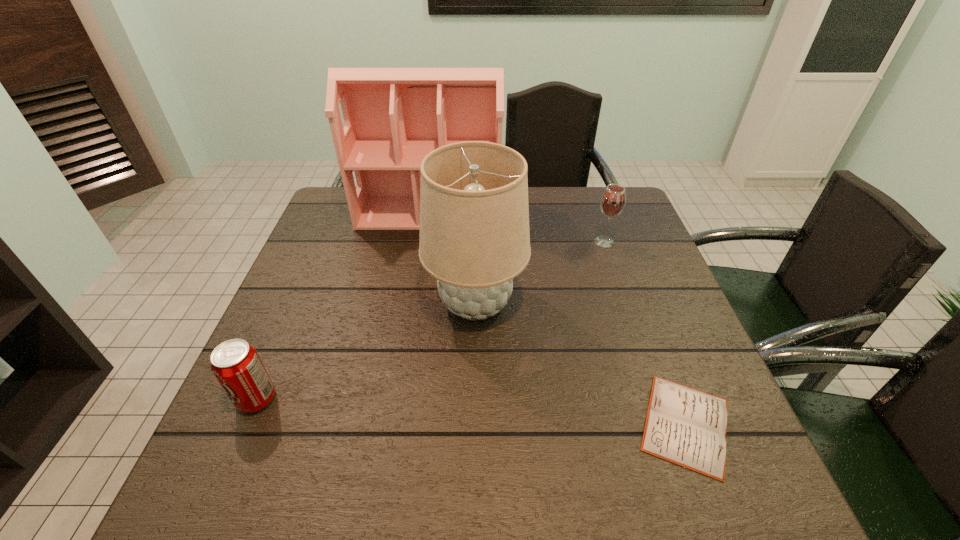
Where is `dollhouse`? This screenshot has height=540, width=960. dollhouse is located at coordinates (394, 117).

What are the coordinates of `the third nearest object` in the screenshot? It's located at pyautogui.click(x=474, y=239).

Locate an element on the screen. The image size is (960, 540). the fourth nearest object is located at coordinates (613, 200).

Find the location of a particular element. The width and height of the screenshot is (960, 540). the third tallest object is located at coordinates (613, 200).

I want to click on soda, so click(x=236, y=364).

Locate an element on the screen. The width and height of the screenshot is (960, 540). the leftmost object is located at coordinates (236, 364).

Image resolution: width=960 pixels, height=540 pixels. I want to click on the shortest object, so click(687, 427).

Find the location of a particular element. Image resolution: width=960 pixels, height=540 pixels. vacant space situated 0.400m on the front-facing side of the dollhouse is located at coordinates (410, 336).

Where is `vacant region located 0.120m on the left of the lampshade`? vacant region located 0.120m on the left of the lampshade is located at coordinates (375, 303).

Find the location of a particular element. The image size is (960, 540). free spot located 0.340m on the left of the third tallest object is located at coordinates (472, 242).